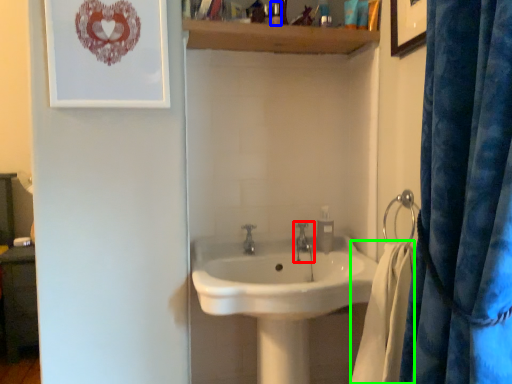
Question: Estimate the real-world distances between objects in this image. Which object is closer to tap (highlighted by a red box), toiletry (highlighted by a blue box) or bath towel (highlighted by a green box)?

Choices:
 (A) toiletry
 (B) bath towel

Answer: (B)